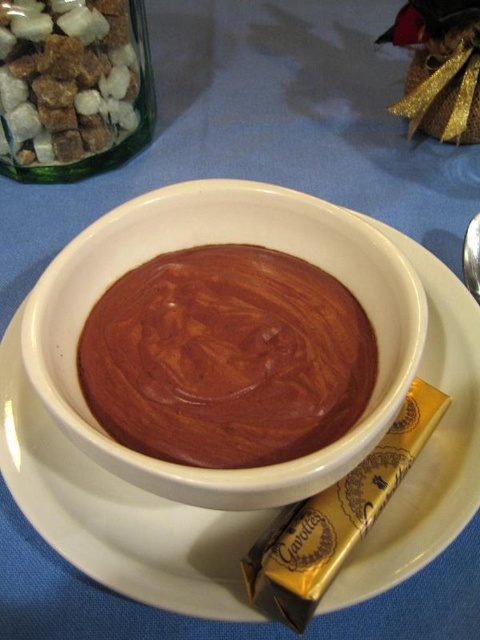
Is gold foil chocolate bar at center bigger than silver metallic spoon at upper right?

Indeed, gold foil chocolate bar at center has a larger size compared to silver metallic spoon at upper right.

Is gold foil chocolate bar at center behind silver metallic spoon at upper right?

A: No, it is in front of silver metallic spoon at upper right.

Which is behind, point (393, 428) or point (472, 221)?

Positioned behind is point (472, 221).

Find the location of a particular element. Image resolution: width=480 pixels, height=640 pixels. gold foil chocolate bar at center is located at coordinates (336, 518).

Can you confirm if brown sugar cubes at upper left is thinner than gold foil chocolate bar at center?

No, brown sugar cubes at upper left is not thinner than gold foil chocolate bar at center.

How distant is brown sugar cubes at upper left from gold foil chocolate bar at center?

brown sugar cubes at upper left and gold foil chocolate bar at center are 17.38 inches apart.

Who is more distant from viewer, (50,100) or (274,563)?

The point (50,100) is more distant.

Locate an element on the screen. This screenshot has height=640, width=480. brown sugar cubes at upper left is located at coordinates (67, 77).

In the scene shown: Who is positioned more to the right, white ceramic plate at center or gold foil chocolate bar at center?

gold foil chocolate bar at center

Does white ceramic plate at center have a lesser height compared to gold foil chocolate bar at center?

In fact, white ceramic plate at center may be taller than gold foil chocolate bar at center.

Locate an element on the screen. This screenshot has width=480, height=640. white ceramic plate at center is located at coordinates (118, 513).